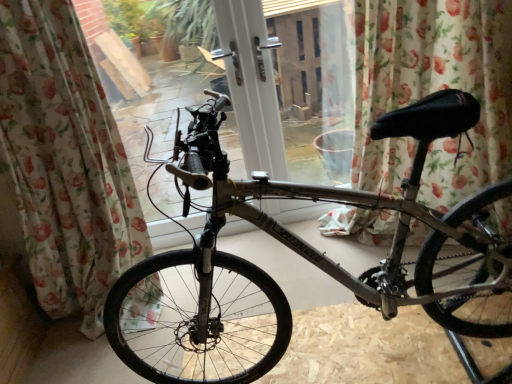
Find the location of a particular element. The width and height of the screenshot is (512, 384). floral fabric curtain at center, positioned as the first curtain in right-to-left order is located at coordinates (433, 91).

The height and width of the screenshot is (384, 512). I want to click on silver metallic bicycle at center, so click(x=306, y=258).

Identify the location of floral fabric curtain at left, positioned as the 1th curtain in left-to-right order. (65, 162).

Which object is wider, silver metallic bicycle at center or floral fabric curtain at left, positioned as the 1th curtain in left-to-right order?

silver metallic bicycle at center is wider.

In the scene shown: From the image's perspective, who appears lower, silver metallic bicycle at center or floral fabric curtain at left, positioned as the 1th curtain in left-to-right order?

silver metallic bicycle at center.

Locate an element on the screen. This screenshot has height=384, width=512. the 2nd curtain located above the silver metallic bicycle at center (from a real-world perspective) is located at coordinates (65, 162).

Where is `curtain in front of the floral fabric curtain at center, arranged as the second curtain when viewed from the left`? The image size is (512, 384). curtain in front of the floral fabric curtain at center, arranged as the second curtain when viewed from the left is located at coordinates (65, 162).

Looking at this image, measure the distance between floral fabric curtain at left, acting as the 2th curtain starting from the right, and floral fabric curtain at center, arranged as the second curtain when viewed from the left.

They are 4.39 feet apart.

From a real-world perspective, which object stands above the other?

floral fabric curtain at left, positioned as the 1th curtain in left-to-right order, is physically above.

Is floral fabric curtain at left, acting as the 2th curtain starting from the right, not near floral fabric curtain at center, arranged as the second curtain when viewed from the left?

floral fabric curtain at left, acting as the 2th curtain starting from the right, is far away from floral fabric curtain at center, arranged as the second curtain when viewed from the left.

Can you confirm if floral fabric curtain at left, acting as the 2th curtain starting from the right, is positioned to the right of silver metallic bicycle at center?

Incorrect, floral fabric curtain at left, acting as the 2th curtain starting from the right, is not on the right side of silver metallic bicycle at center.

Is floral fabric curtain at left, acting as the 2th curtain starting from the right, taller or shorter than silver metallic bicycle at center?

Considering their sizes, floral fabric curtain at left, acting as the 2th curtain starting from the right, has more height than silver metallic bicycle at center.

At what (x,y) coordinates should I click in order to perform the action: click on bicycle in front of the floral fabric curtain at left, positioned as the 1th curtain in left-to-right order. Please return your answer as a coordinate pair (x, y). This screenshot has width=512, height=384. Looking at the image, I should click on (x=306, y=258).

Can you confirm if silver metallic bicycle at center is taller than floral fabric curtain at center, arranged as the second curtain when viewed from the left?

In fact, silver metallic bicycle at center may be shorter than floral fabric curtain at center, arranged as the second curtain when viewed from the left.

Is silver metallic bicycle at center positioned with its back to floral fabric curtain at center, arranged as the second curtain when viewed from the left?

That's not correct — silver metallic bicycle at center is not looking away from floral fabric curtain at center, arranged as the second curtain when viewed from the left.

Which object is positioned more to the right, silver metallic bicycle at center or floral fabric curtain at center, arranged as the second curtain when viewed from the left?

From the viewer's perspective, floral fabric curtain at center, arranged as the second curtain when viewed from the left, appears more on the right side.

Considering the positions of objects silver metallic bicycle at center and floral fabric curtain at center, positioned as the first curtain in right-to-left order, in the image provided, who is in front, silver metallic bicycle at center or floral fabric curtain at center, positioned as the first curtain in right-to-left order,?

silver metallic bicycle at center.

Looking at this image, can you tell me how much floral fabric curtain at center, positioned as the first curtain in right-to-left order, and floral fabric curtain at left, positioned as the 1th curtain in left-to-right order, differ in facing direction?

1.2 degrees separate the facing orientations of floral fabric curtain at center, positioned as the first curtain in right-to-left order, and floral fabric curtain at left, positioned as the 1th curtain in left-to-right order.

Is floral fabric curtain at center, arranged as the second curtain when viewed from the left, aimed at floral fabric curtain at left, acting as the 2th curtain starting from the right?

No, floral fabric curtain at center, arranged as the second curtain when viewed from the left, is not facing towards floral fabric curtain at left, acting as the 2th curtain starting from the right.

Looking at this image, is floral fabric curtain at left, positioned as the 1th curtain in left-to-right order, surrounded by floral fabric curtain at center, positioned as the first curtain in right-to-left order?

No, floral fabric curtain at left, positioned as the 1th curtain in left-to-right order, is not a part of floral fabric curtain at center, positioned as the first curtain in right-to-left order.

Consider the image. Which object is more forward, floral fabric curtain at center, positioned as the first curtain in right-to-left order, or floral fabric curtain at left, positioned as the 1th curtain in left-to-right order?

Positioned in front is floral fabric curtain at left, positioned as the 1th curtain in left-to-right order.

Which object is closer to the camera, floral fabric curtain at center, positioned as the first curtain in right-to-left order, or silver metallic bicycle at center?

silver metallic bicycle at center is closer to the camera.

Which of these two, floral fabric curtain at center, positioned as the first curtain in right-to-left order, or silver metallic bicycle at center, stands shorter?

silver metallic bicycle at center.

From the image's perspective, is floral fabric curtain at center, arranged as the second curtain when viewed from the left, located above or below silver metallic bicycle at center?

Clearly, from the image's perspective, floral fabric curtain at center, arranged as the second curtain when viewed from the left, is above silver metallic bicycle at center.

How different are the orientations of floral fabric curtain at center, positioned as the first curtain in right-to-left order, and silver metallic bicycle at center in degrees?

The angular difference between floral fabric curtain at center, positioned as the first curtain in right-to-left order, and silver metallic bicycle at center is 88.7 degrees.

Locate an element on the screen. The height and width of the screenshot is (384, 512). bicycle that appears below the floral fabric curtain at left, acting as the 2th curtain starting from the right (from the image's perspective) is located at coordinates (306, 258).

I want to click on curtain that appears on the right of floral fabric curtain at left, positioned as the 1th curtain in left-to-right order, so click(x=433, y=91).

Estimate the real-world distances between objects in this image. Which object is closer to floral fabric curtain at left, positioned as the 1th curtain in left-to-right order, floral fabric curtain at center, positioned as the first curtain in right-to-left order, or silver metallic bicycle at center?

silver metallic bicycle at center.

Estimate the real-world distances between objects in this image. Which object is further from floral fabric curtain at left, acting as the 2th curtain starting from the right, silver metallic bicycle at center or floral fabric curtain at center, positioned as the first curtain in right-to-left order?

floral fabric curtain at center, positioned as the first curtain in right-to-left order, is positioned further to the anchor floral fabric curtain at left, acting as the 2th curtain starting from the right.

Based on the photo, from the image, which object appears to be farther from silver metallic bicycle at center, floral fabric curtain at left, positioned as the 1th curtain in left-to-right order, or floral fabric curtain at center, positioned as the first curtain in right-to-left order?

Based on the image, floral fabric curtain at left, positioned as the 1th curtain in left-to-right order, appears to be further to silver metallic bicycle at center.

Based on their spatial positions, is floral fabric curtain at left, acting as the 2th curtain starting from the right, or silver metallic bicycle at center further from floral fabric curtain at center, arranged as the second curtain when viewed from the left?

Based on the image, floral fabric curtain at left, acting as the 2th curtain starting from the right, appears to be further to floral fabric curtain at center, arranged as the second curtain when viewed from the left.

Looking at the image, which one is located closer to silver metallic bicycle at center, floral fabric curtain at center, arranged as the second curtain when viewed from the left, or floral fabric curtain at left, positioned as the 1th curtain in left-to-right order?

Among the two, floral fabric curtain at center, arranged as the second curtain when viewed from the left, is located nearer to silver metallic bicycle at center.

Estimate the real-world distances between objects in this image. Which object is closer to floral fabric curtain at center, positioned as the first curtain in right-to-left order, silver metallic bicycle at center or floral fabric curtain at left, acting as the 2th curtain starting from the right?

silver metallic bicycle at center is closer to floral fabric curtain at center, positioned as the first curtain in right-to-left order.

Locate an element on the screen. The image size is (512, 384). bicycle between floral fabric curtain at left, acting as the 2th curtain starting from the right, and floral fabric curtain at center, positioned as the first curtain in right-to-left order is located at coordinates (306, 258).